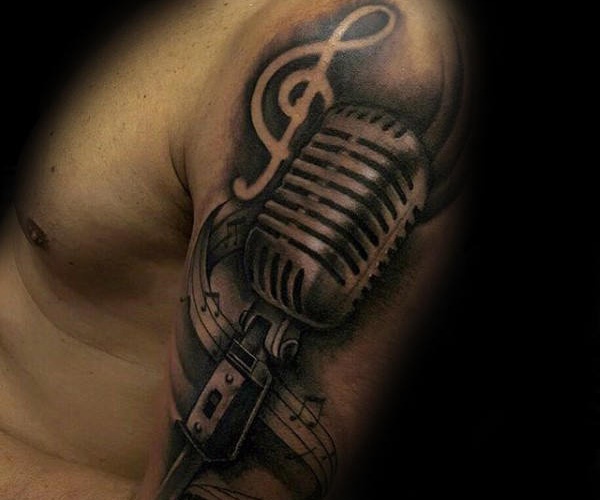
Identify the location of chest. The width and height of the screenshot is (600, 500). pos(70,177).